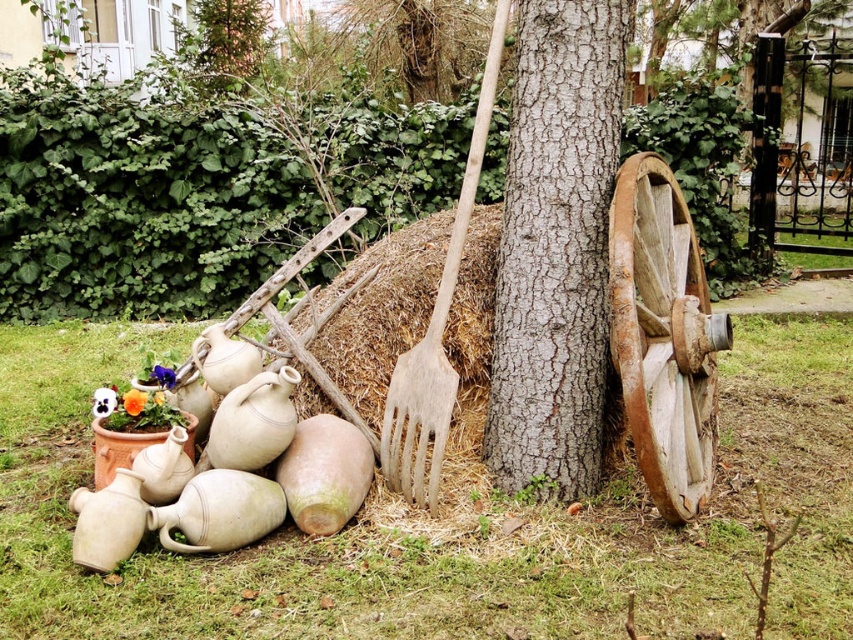
Question: Does brown rough bark at center appear on the right side of weathered wood wagon wheel at right?

Choices:
 (A) yes
 (B) no

Answer: (B)

Question: Does wooden fork at center have a smaller size compared to orange matte flower at lower left?

Choices:
 (A) yes
 (B) no

Answer: (B)

Question: Which object is closer to the camera taking this photo?

Choices:
 (A) orange matte flower at lower left
 (B) purple matte flower at lower left
 (C) brown rough bark at center

Answer: (C)

Question: Which object is farther from the camera taking this photo?

Choices:
 (A) wooden fork at center
 (B) brown rough bark at center

Answer: (A)

Question: Among these objects, which one is nearest to the camera?

Choices:
 (A) weathered wood wagon wheel at right
 (B) orange matte flower at lower left
 (C) purple matte flower at lower left
 (D) brown textured tree trunk at center

Answer: (A)

Question: Does brown rough bark at center appear over purple matte flower at lower left?

Choices:
 (A) no
 (B) yes

Answer: (B)